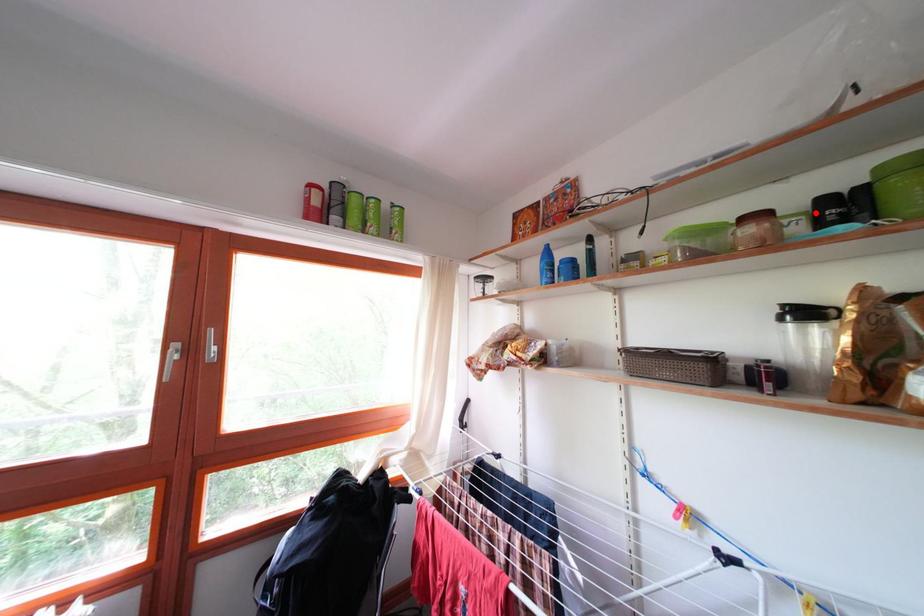
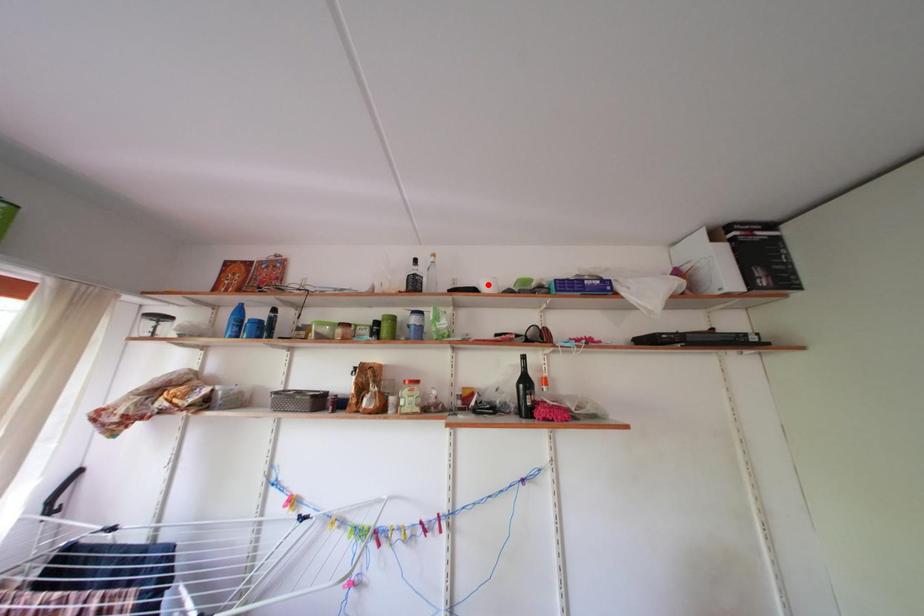
I am providing you with two images of the same scene from different viewpoints. A red point is marked on the first image and another point is marked on the second image. Do the highlighted points in image1 and image2 indicate the same real-world spot?

No